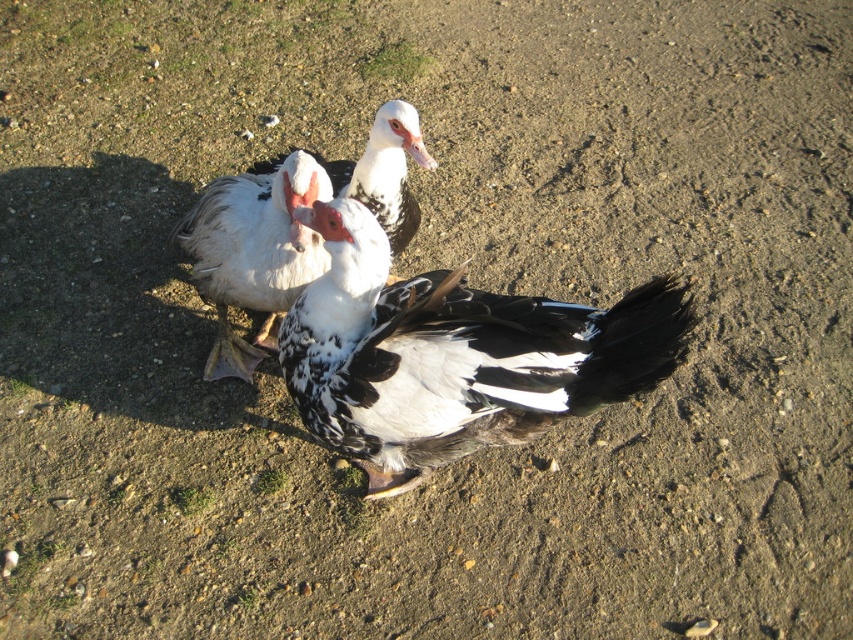
You are standing in an outdoor area with three ducks. You notice a point marked at coordinates (454, 355). Based on the scene description, what animal is located at that point?

The point at (454, 355) indicates a speckled feathered goose at center.

You are a birdwatcher observing the scene. You notice the speckled feathered goose at center and the white speckled feather at center. Which object is closer to you?

The speckled feathered goose at center is closer to you because it is in front of the white speckled feather at center.

You are standing at the origin point of the coordinate system, which is at the bottom left corner of the image. You want to locate the speckled feathered goose at center. What are its coordinates?

The coordinates of the speckled feathered goose at center are at point (454, 355).